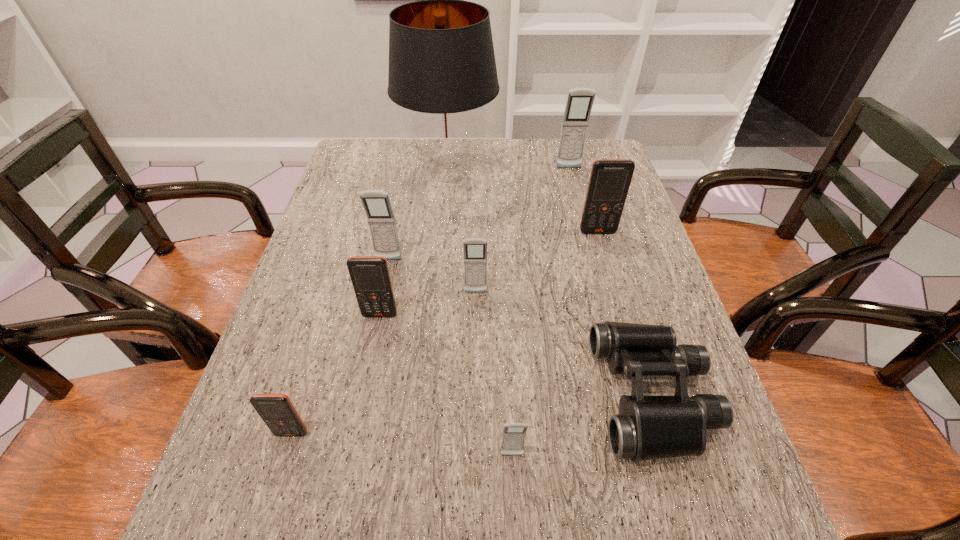
Where is `free space located 0.140m on the front-facing side of the fifth nearest cellular telephone`? free space located 0.140m on the front-facing side of the fifth nearest cellular telephone is located at coordinates coord(379,306).

Find the location of a particular element. free point located on the screen of the second farthest cellular telephone is located at coordinates [614, 292].

At what (x,y) coordinates should I click in order to perform the action: click on free space located 0.300m on the front-facing side of the fifth nearest object. Please return your answer as a coordinate pair (x, y). The width and height of the screenshot is (960, 540). Looking at the image, I should click on (475, 414).

The width and height of the screenshot is (960, 540). Find the location of `blank space located on the screen of the second farthest orange cellular telephone`. blank space located on the screen of the second farthest orange cellular telephone is located at coordinates (348, 472).

Identify the location of free space located 0.140m on the screen of the second nearest cellular telephone. (265, 522).

Find the location of a particular element. The height and width of the screenshot is (540, 960). free region located on the front-facing side of the shortest object is located at coordinates (508, 395).

You are a GUI agent. You are given a task and a screenshot of the screen. Output one action in this format:
    pyautogui.click(x=<x>, y=<y>)
    Task: Click on the free space located on the front-facing side of the shortest object
    
    Given the screenshot: What is the action you would take?
    pyautogui.click(x=401, y=395)

At what (x,y) coordinates should I click in order to perform the action: click on free space located on the front-facing side of the shortest object. Please return your answer as a coordinate pair (x, y). The image size is (960, 540). Looking at the image, I should click on (573, 395).

I want to click on lampshade that is at the far edge, so [x=442, y=69].

You are a GUI agent. You are given a task and a screenshot of the screen. Output one action in this format:
    pyautogui.click(x=<x>, y=<y>)
    Task: Click on the cellular telephone located at the far edge
    The height and width of the screenshot is (540, 960).
    Given the screenshot: What is the action you would take?
    pyautogui.click(x=579, y=103)